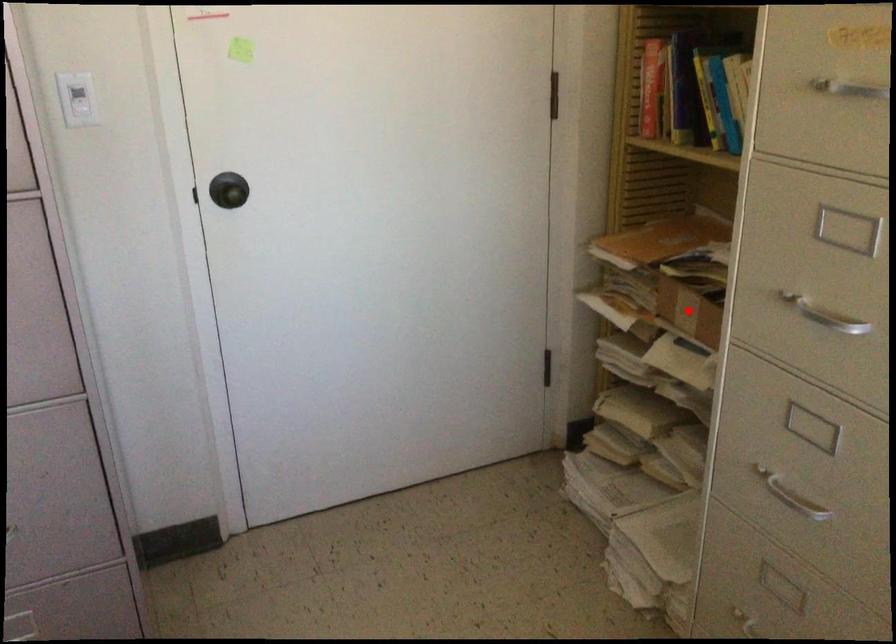
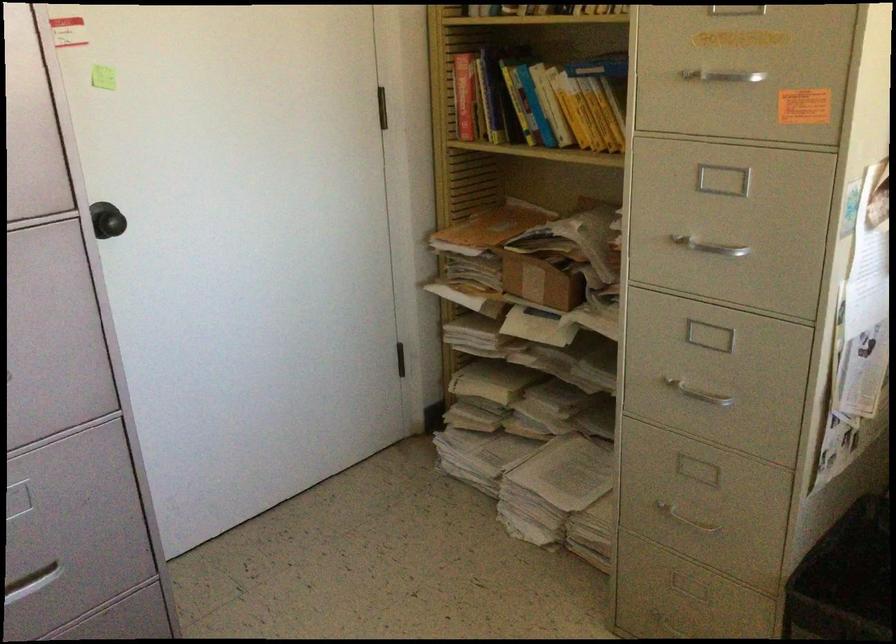
In the second image, find the point that corresponds to the highlighted location in the first image.

(539, 281)